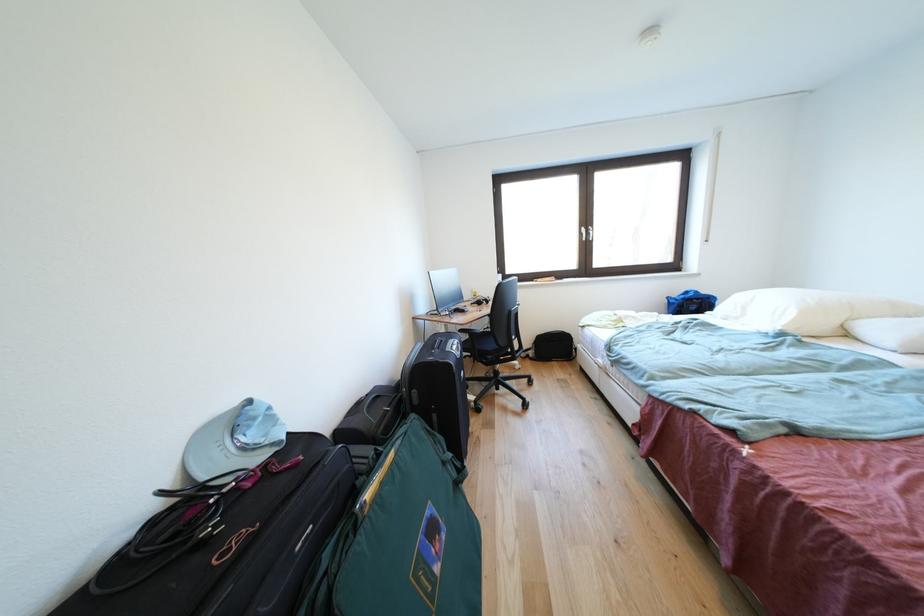
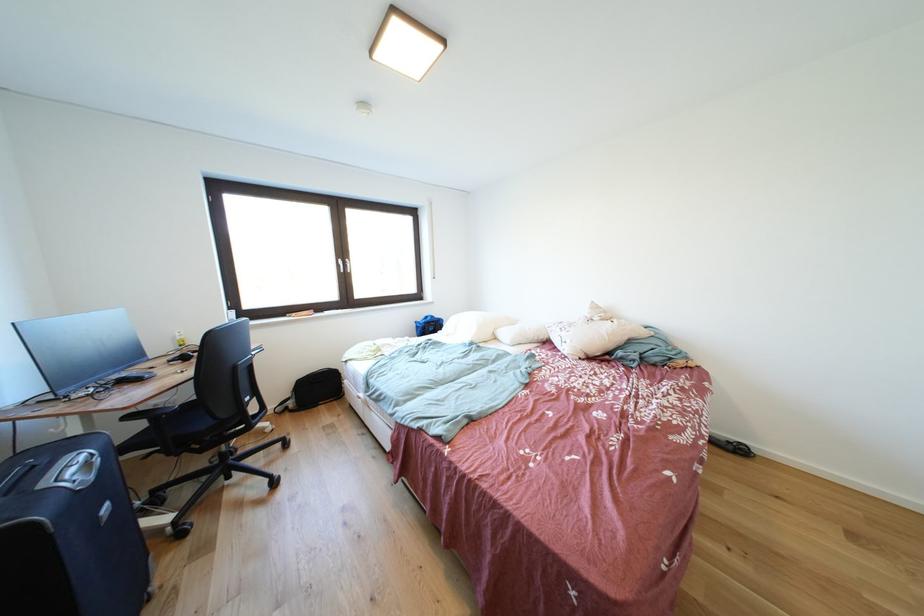
In the second image, find the point that corresponds to (x=540, y=357) in the first image.

(299, 408)